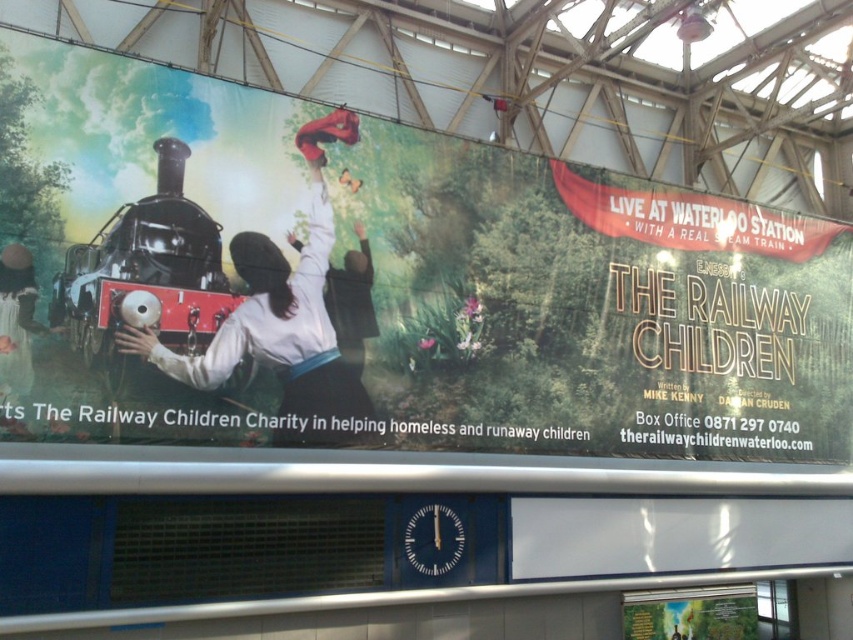
Looking at this image, between matte black train at upper left and polished brass steam engine at left, which one appears on the left side from the viewer's perspective?

polished brass steam engine at left is more to the left.

Can you confirm if matte black train at upper left is wider than polished brass steam engine at left?

Yes, matte black train at upper left is wider than polished brass steam engine at left.

Does point (585, 282) come in front of point (155, 292)?

No, (585, 282) is behind (155, 292).

You are a GUI agent. You are given a task and a screenshot of the screen. Output one action in this format:
    pyautogui.click(x=<x>, y=<y>)
    Task: Click on the matte black train at upper left
    This screenshot has width=853, height=640.
    Given the screenshot: What is the action you would take?
    [386, 284]